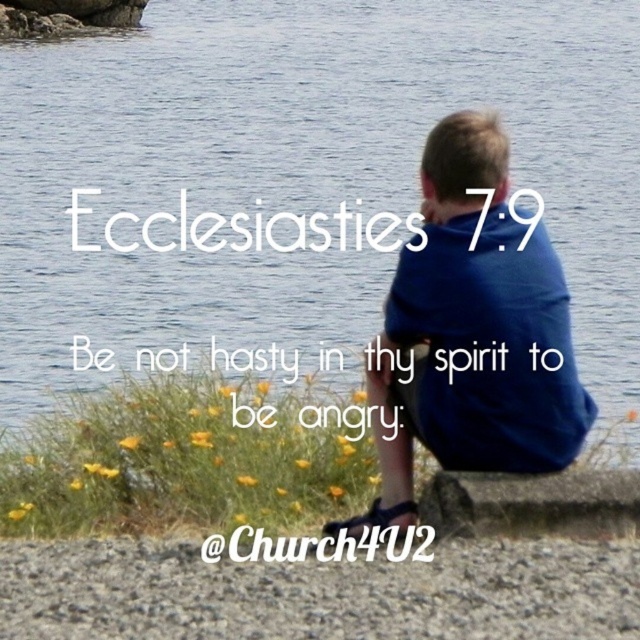
Measure the distance between transparent water at center and smooth gray stone at lower center.

A distance of 10.12 meters exists between transparent water at center and smooth gray stone at lower center.

The height and width of the screenshot is (640, 640). Identify the location of transparent water at center. (301, 172).

Between blue fabric shirt at center and smooth gray stone at lower center, which one appears on the right side from the viewer's perspective?

Positioned to the right is smooth gray stone at lower center.

Can you confirm if blue fabric shirt at center is smaller than smooth gray stone at lower center?

Actually, blue fabric shirt at center might be larger than smooth gray stone at lower center.

Locate an element on the screen. Image resolution: width=640 pixels, height=640 pixels. blue fabric shirt at center is located at coordinates (472, 333).

Who is positioned more to the right, transparent water at center or blue fabric shirt at center?

Positioned to the right is blue fabric shirt at center.

How far apart are transparent water at center and blue fabric shirt at center?

A distance of 69.45 feet exists between transparent water at center and blue fabric shirt at center.

Between point (134, 148) and point (397, 502), which one is positioned in front?

Positioned in front is point (397, 502).

The height and width of the screenshot is (640, 640). I want to click on transparent water at center, so [301, 172].